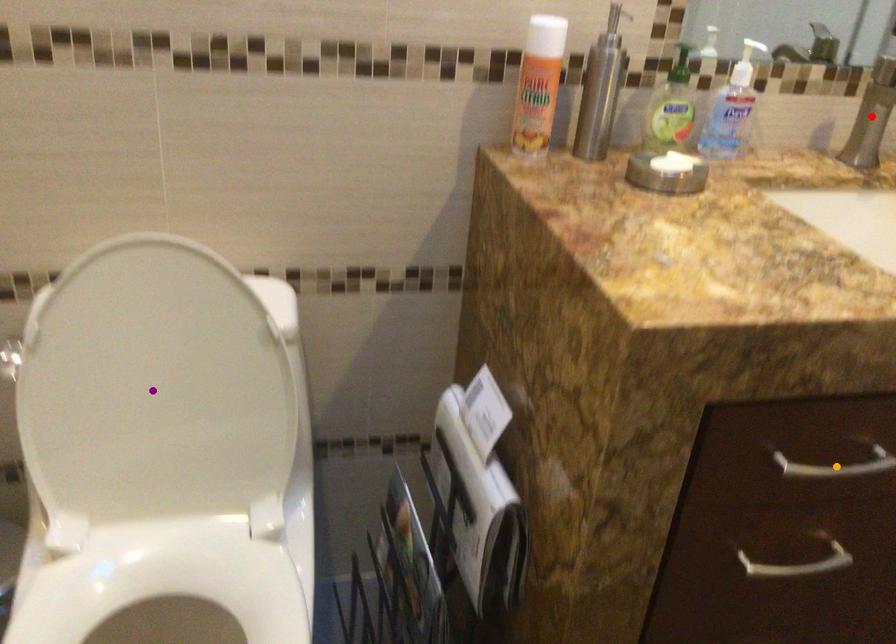
Consider the image. Order these from nearest to farthest:
A) orange point
B) purple point
C) red point

orange point, purple point, red point